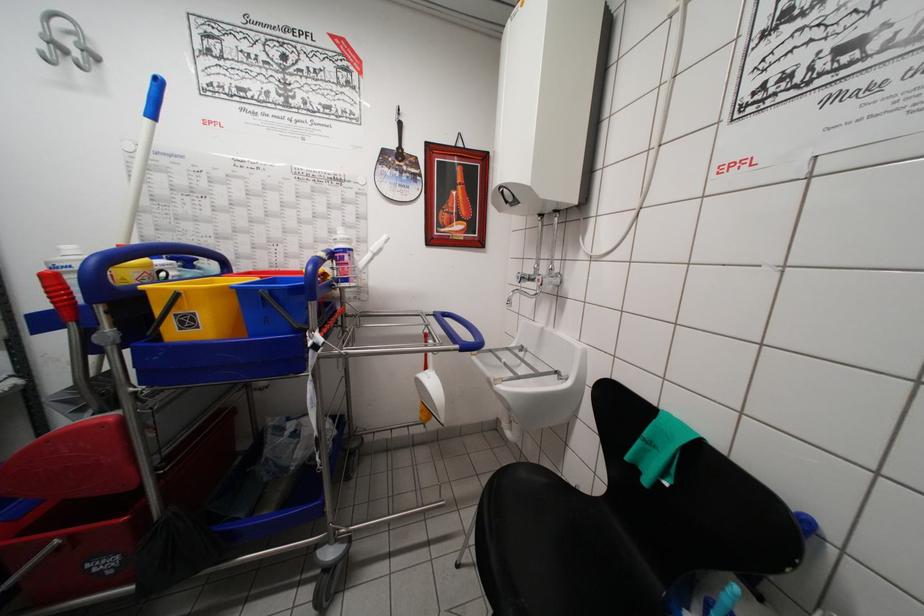
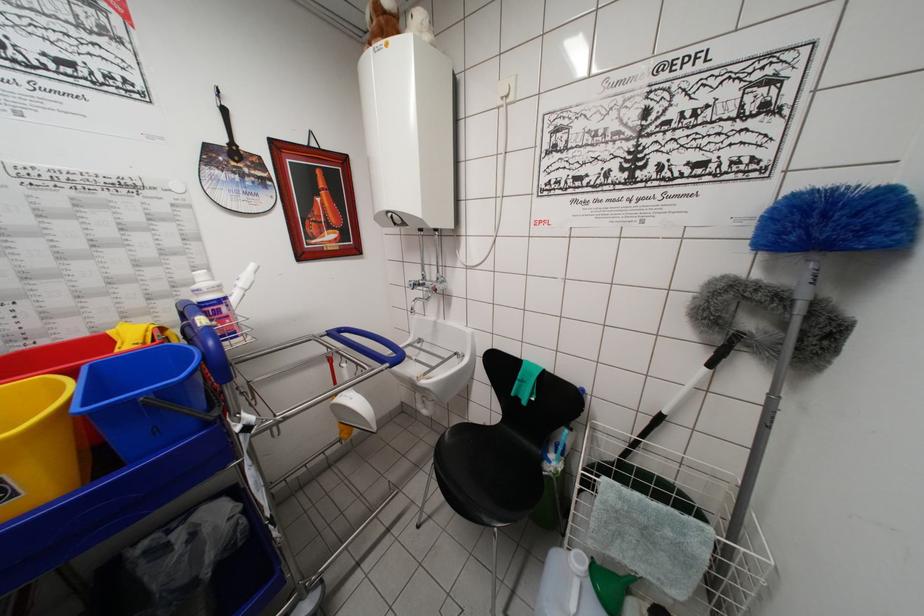
The point at (x=343, y=261) is marked in the first image. Where is the corresponding point in the second image?

(215, 315)